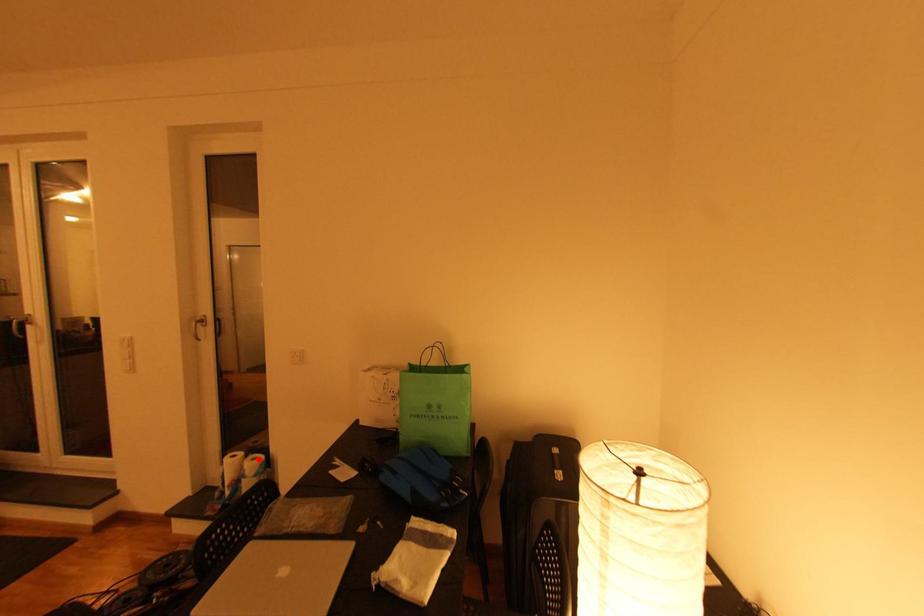
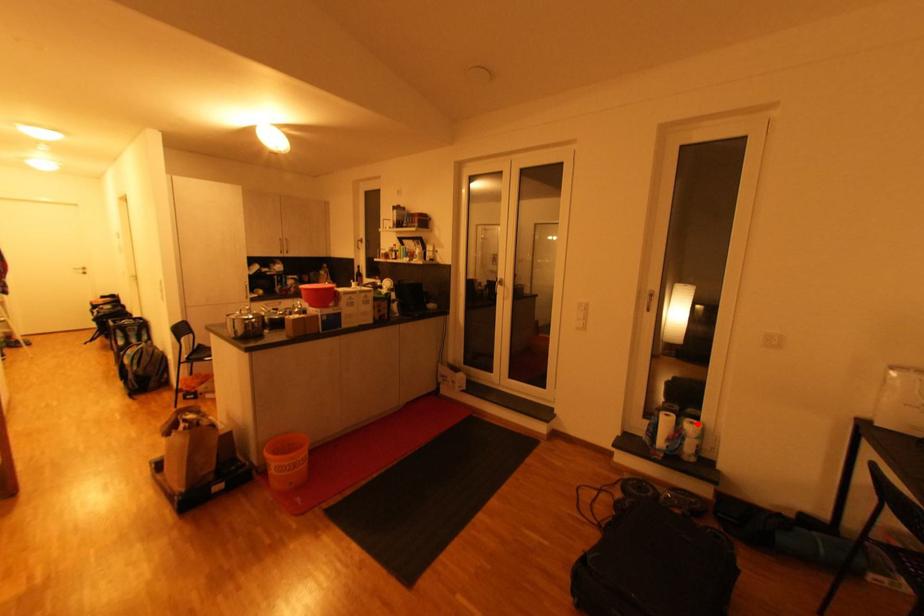
I am providing you with two images of the same scene from different viewpoints. A red point is marked on the first image and another point is marked on the second image. Does the point marked in image1 correspond to the same location as the one in image2?

Yes